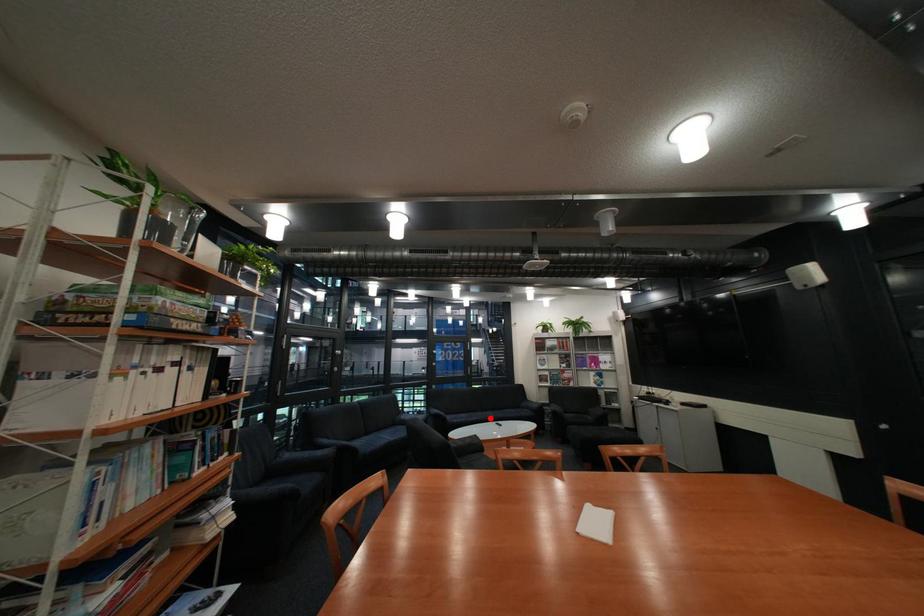
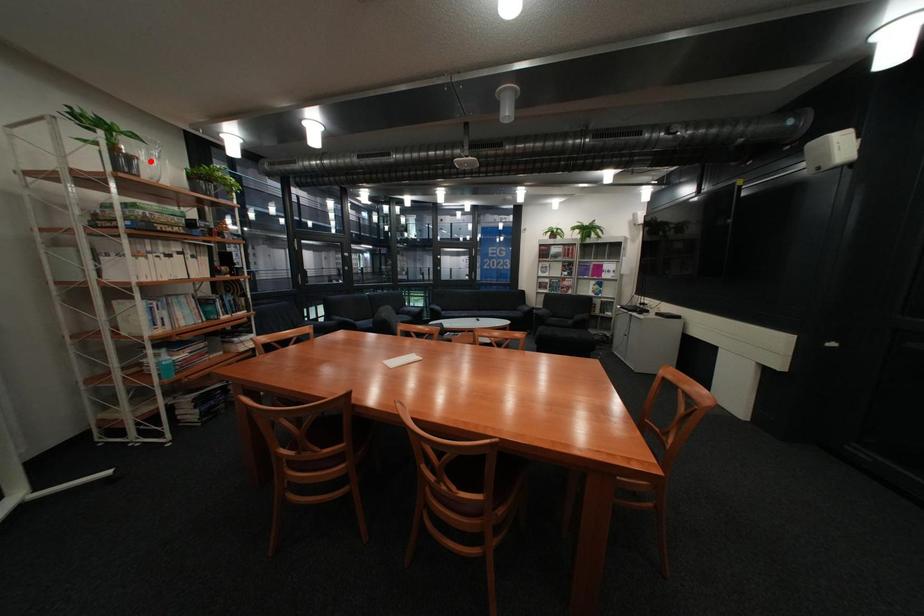
I am providing you with two images of the same scene from different viewpoints. A red point is marked on the first image and another point is marked on the second image. Do the highlighted points in image1 and image2 indicate the same real-world spot?

No